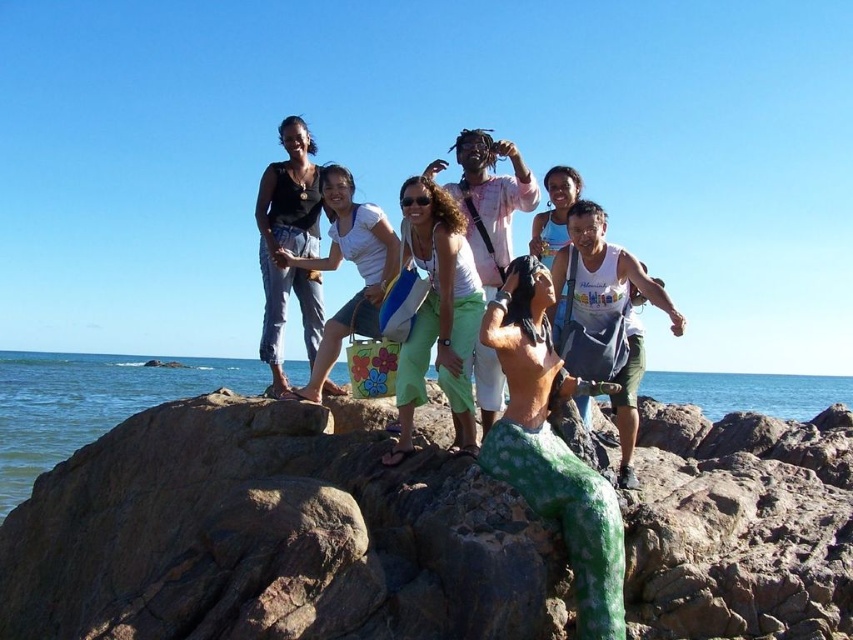
You are a photographer setting up a tripod to take a group photo of the seven people on the rocky outcrop. You need to place the tripod in a position where it won t block the view of the green painted rock at center and the white fabric bag at center. Considering their heights, which object should you position the tripod closer to?

The green painted rock at center is not as tall as the white fabric bag at center, so you should position the tripod closer to the white fabric bag at center to ensure it doesn t block the view of the taller object.

You are a photographer standing on the rocky outcrop and want to take a photo of the green painted rock at center and the white fabric bag at center. Which object is positioned closer to the camera?

The green painted rock at center is closer to the viewer than the white fabric bag at center, so it will appear closer to the camera.